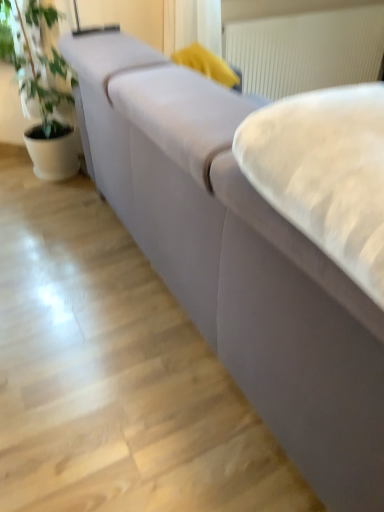
You are a GUI agent. You are given a task and a screenshot of the screen. Output one action in this format:
    pyautogui.click(x=<x>, y=<y>)
    Task: Click on the free spot above white textured radiator at upper center (from a real-world perspective)
    The width and height of the screenshot is (384, 512).
    Given the screenshot: What is the action you would take?
    pyautogui.click(x=313, y=8)